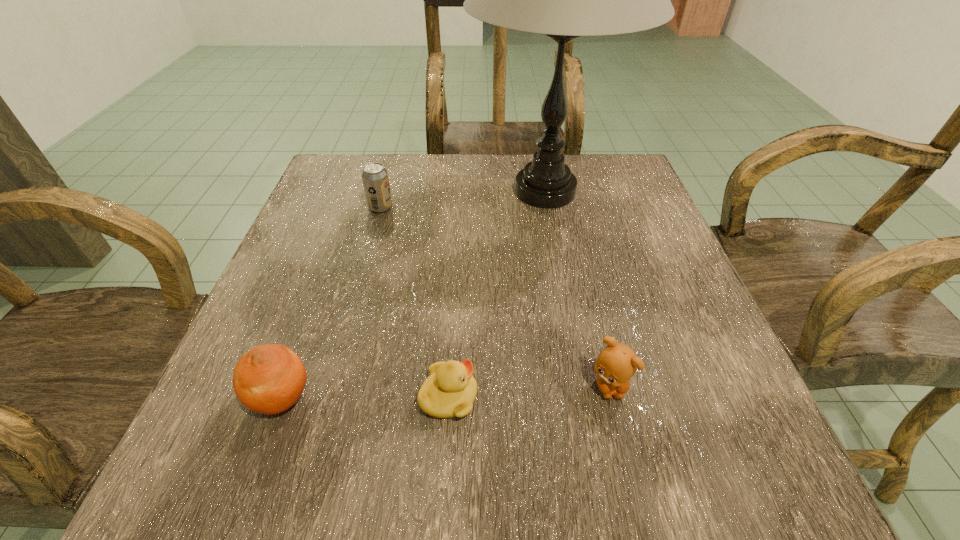
Locate an element on the screen. The width and height of the screenshot is (960, 540). the tallest object is located at coordinates (564, 0).

You are a GUI agent. You are given a task and a screenshot of the screen. Output one action in this format:
    pyautogui.click(x=<x>, y=<y>)
    Task: Click on the beer can
    The height and width of the screenshot is (540, 960).
    Given the screenshot: What is the action you would take?
    pyautogui.click(x=375, y=179)

The height and width of the screenshot is (540, 960). I want to click on orange, so click(x=268, y=379).

Locate an element on the screen. This screenshot has width=960, height=540. teddy bear is located at coordinates (616, 364).

Where is `duckling`? The height and width of the screenshot is (540, 960). duckling is located at coordinates (450, 390).

Identify the location of vacant area situated on the left of the lamp. (406, 191).

Where is `blank space located on the right of the beer can`? blank space located on the right of the beer can is located at coordinates (567, 207).

Find the location of a particular element. The width and height of the screenshot is (960, 540). vacant region located 0.080m on the front of the orange is located at coordinates (249, 489).

Find the location of `vacant space located 0.090m on the face of the teddy bear`. vacant space located 0.090m on the face of the teddy bear is located at coordinates (628, 467).

The image size is (960, 540). Identify the location of vacant space situated on the front-facing side of the duckling. 513,397.